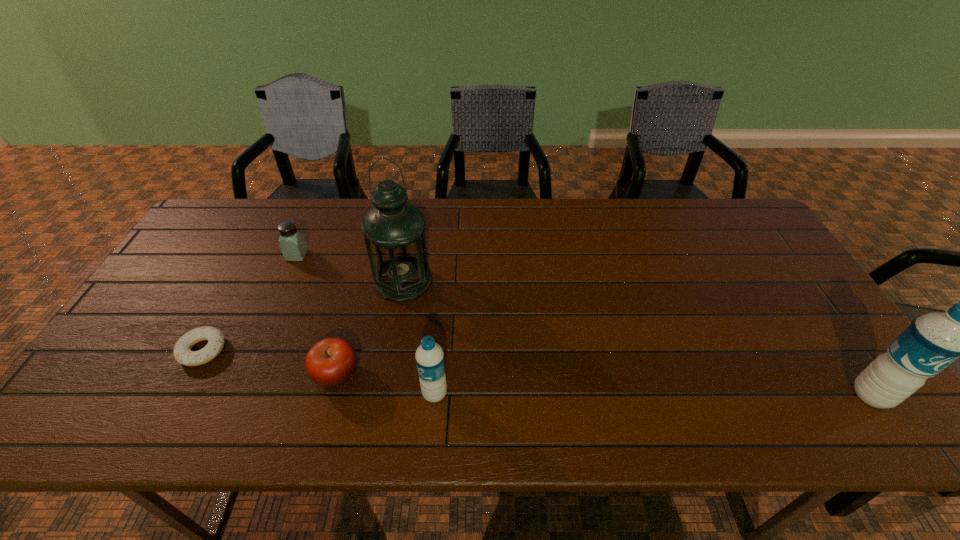
Where is `vacant space located 0.280m on the label of the shorter water bottle`? This screenshot has width=960, height=540. vacant space located 0.280m on the label of the shorter water bottle is located at coordinates (300, 394).

Image resolution: width=960 pixels, height=540 pixels. I want to click on free space located on the label of the shorter water bottle, so click(322, 394).

In order to click on vacant position located on the right of the saltshaker in this screenshot , I will do [x=385, y=255].

This screenshot has width=960, height=540. I want to click on vacant space situated 0.250m on the front of the oil lamp, so click(386, 382).

The width and height of the screenshot is (960, 540). I want to click on free point located on the right of the doughnut, so click(x=338, y=350).

Identify the location of vacant region located on the right of the apple. (512, 374).

Locate an element on the screen. doughnut located in the near edge section of the desktop is located at coordinates (182, 352).

I want to click on apple at the near edge, so click(x=331, y=362).

Locate an element on the screen. The image size is (960, 540). object that is at the left edge is located at coordinates (182, 352).

Identify the location of object that is at the right edge. (932, 342).